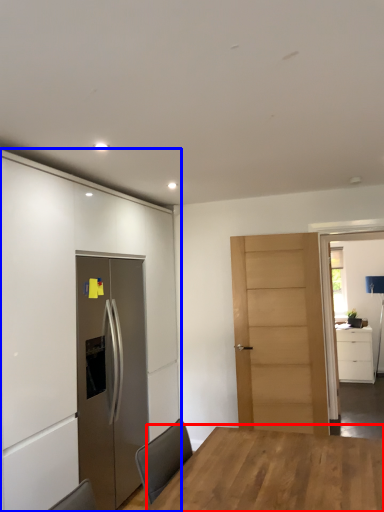
Question: Which point is further to the camera, table (highlighted by a red box) or cabinetry (highlighted by a blue box)?

Choices:
 (A) table
 (B) cabinetry

Answer: (B)